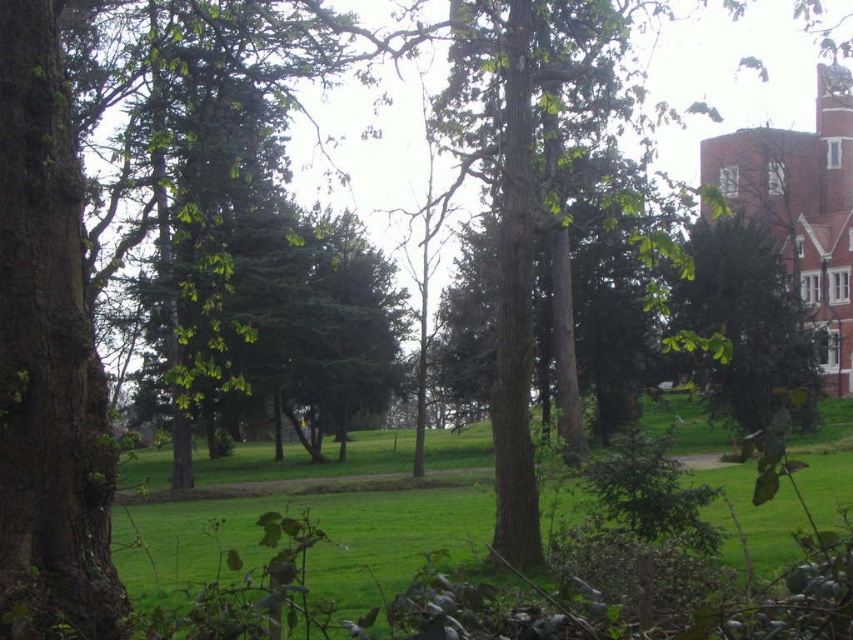
You are a gardener who needs to water both the green grassy at center and the green leafy tree at right. Your watering can holds enough water to cover 10 meters. Can you water both areas without needing to refill your watering can?

The distance between the green grassy at center and the green leafy tree at right is 15.60 meters, which exceeds the watering can capacity of 10 meters. Therefore, you will need to refill your watering can at least once to water both areas.

You are standing at the point labeled point (318, 516) in the park. What type of terrain are you currently standing on?

The point labeled point (318, 516) is on the green grassy area at center, so you are standing on grass.

You are standing on the dirt path in the park and want to walk towards the green leafy tree at right. Which direction should you head from the green grassy at center?

Since the green grassy at center is to the left of the green leafy tree at right, you should head to the right from the green grassy at center to reach the green leafy tree at right.